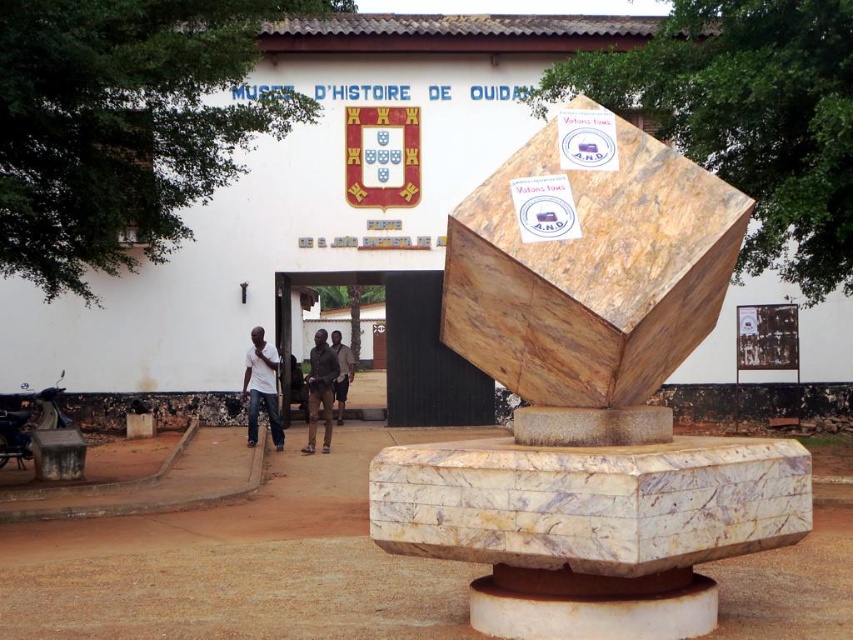
Is marble sculpture at center further to the viewer compared to white matte shirt at left?

No, it is not.

Which is behind, point (535, 300) or point (251, 356)?

Positioned behind is point (251, 356).

Identify the location of marble sculpture at center. Image resolution: width=853 pixels, height=640 pixels. (589, 396).

Is white matte shirt at left taller than brown leather jacket at center?

No.

How far apart are white matte shirt at left and brown leather jacket at center?

white matte shirt at left is 3.91 feet away from brown leather jacket at center.

Identify the location of white matte shirt at left. (260, 387).

Find the location of a particular element. The height and width of the screenshot is (640, 853). white matte shirt at left is located at coordinates (260, 387).

Who is positioned more to the left, brown leather jacket at center or dark brown leather pants at center?

Positioned to the left is brown leather jacket at center.

Does brown leather jacket at center have a lesser width compared to dark brown leather pants at center?

No.

The width and height of the screenshot is (853, 640). What do you see at coordinates (320, 390) in the screenshot?
I see `brown leather jacket at center` at bounding box center [320, 390].

Find the location of a particular element. brown leather jacket at center is located at coordinates (320, 390).